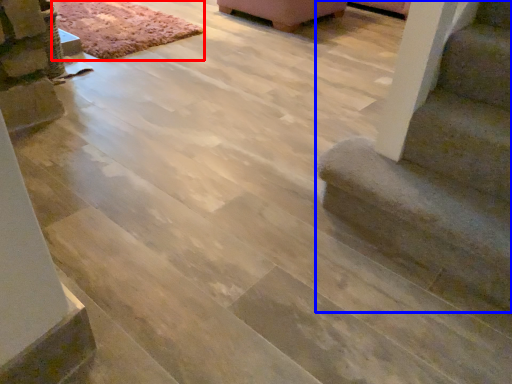
Question: Which point is further to the camera, mat (highlighted by a red box) or stairs (highlighted by a blue box)?

Choices:
 (A) mat
 (B) stairs

Answer: (A)